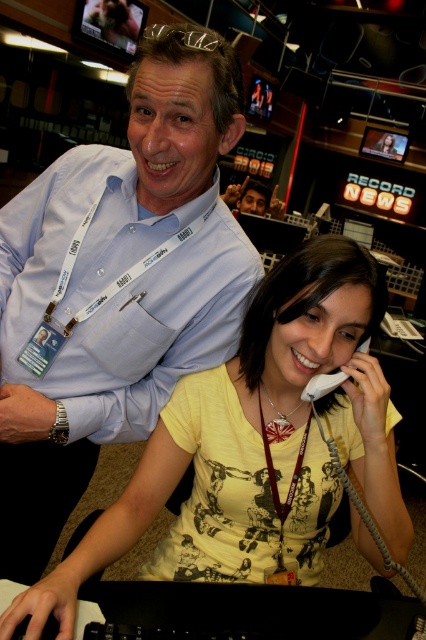
Is point (126, 1) closer to viewer compared to point (281, 529)?

No.

Does metallic glossy monitor at upper left have a lesser height compared to brown fabric lanyard at center?

No, metallic glossy monitor at upper left is not shorter than brown fabric lanyard at center.

The height and width of the screenshot is (640, 426). What do you see at coordinates (111, 24) in the screenshot?
I see `metallic glossy monitor at upper left` at bounding box center [111, 24].

What are the coordinates of `metallic glossy monitor at upper left` in the screenshot? It's located at (111, 24).

Between yellow printed shirt at center and metallic glossy monitor at upper left, which one is positioned lower?

yellow printed shirt at center is below.

Does yellow printed shirt at center have a greater height compared to metallic glossy monitor at upper left?

Correct, yellow printed shirt at center is much taller as metallic glossy monitor at upper left.

Which is in front, point (287, 557) or point (126, 13)?

Point (287, 557) is in front.

Locate an element on the screen. This screenshot has width=426, height=640. yellow printed shirt at center is located at coordinates (256, 445).

Is point (276, 205) less distant than point (365, 128)?

Yes, point (276, 205) is closer to viewer.

Is matte black phone at upper center to the left of glassy black monitor at upper right from the viewer's perspective?

Yes, matte black phone at upper center is to the left of glassy black monitor at upper right.

Is point (276, 188) positioned before point (391, 144)?

No, it is not.

The image size is (426, 640). Identify the location of matte black phone at upper center. (253, 198).